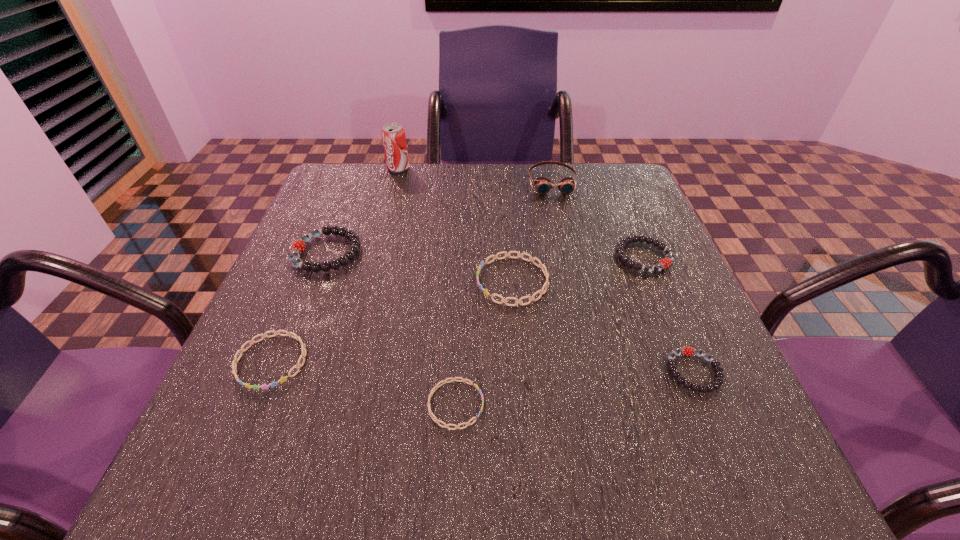
Find the location of a particular element. The image size is (960, 540). vacant area in the image that satisfies the following two spatial constraints: 1. through the lenses of the second biggest black bracelet; 2. on the right side of the goggles is located at coordinates (568, 256).

Locate an element on the screen. The height and width of the screenshot is (540, 960). free space that satisfies the following two spatial constraints: 1. on the back side of the tallest bracelet; 2. on the right side of the soda can is located at coordinates (360, 168).